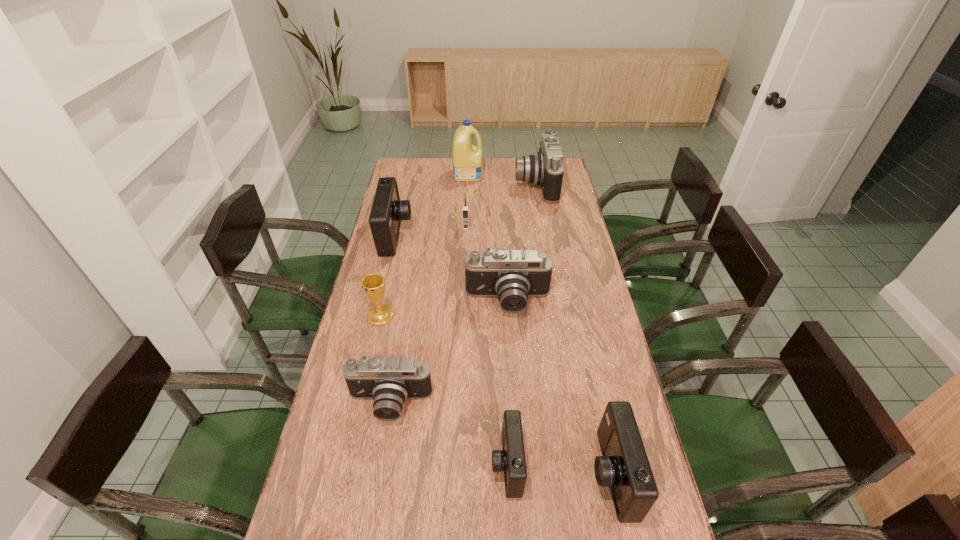
Find the location of a particular element. vacant space located on the front-facing side of the cellular telephone is located at coordinates (464, 277).

At what (x,y) coordinates should I click in order to perform the action: click on blank space located 0.170m on the back of the chalice. Please return your answer as a coordinate pair (x, y). This screenshot has height=540, width=960. Looking at the image, I should click on (390, 274).

You are a GUI agent. You are given a task and a screenshot of the screen. Output one action in this format:
    pyautogui.click(x=<x>, y=<y>)
    Task: Click on the vacant space located 0.260m on the front-facing side of the second smallest blue camera
    
    Given the screenshot: What is the action you would take?
    pyautogui.click(x=487, y=474)

You are a GUI agent. You are given a task and a screenshot of the screen. Output one action in this format:
    pyautogui.click(x=<x>, y=<y>)
    Task: Click on the vacant point located on the front-facing side of the second smallest blue camera
    
    Given the screenshot: What is the action you would take?
    pyautogui.click(x=431, y=474)

Find the location of `vacant space located 0.320m on the front-facing side of the second smallest blue camera`. vacant space located 0.320m on the front-facing side of the second smallest blue camera is located at coordinates (463, 474).

Locate an element on the screen. The height and width of the screenshot is (540, 960). free space located on the front-facing side of the seventh farthest object is located at coordinates (373, 499).

Find the location of a particular element. Image resolution: width=960 pixels, height=540 pixels. free space located on the front-facing side of the second blue camera from right to left is located at coordinates (472, 464).

Find the location of a particular element. Image resolution: width=960 pixels, height=540 pixels. free point located 0.280m on the front-facing side of the second blue camera from right to left is located at coordinates (383, 464).

Locate an element on the screen. vacant space situated 0.270m on the front-facing side of the second blue camera from right to left is located at coordinates (387, 464).

This screenshot has width=960, height=540. I want to click on detergent that is at the far edge, so click(467, 159).